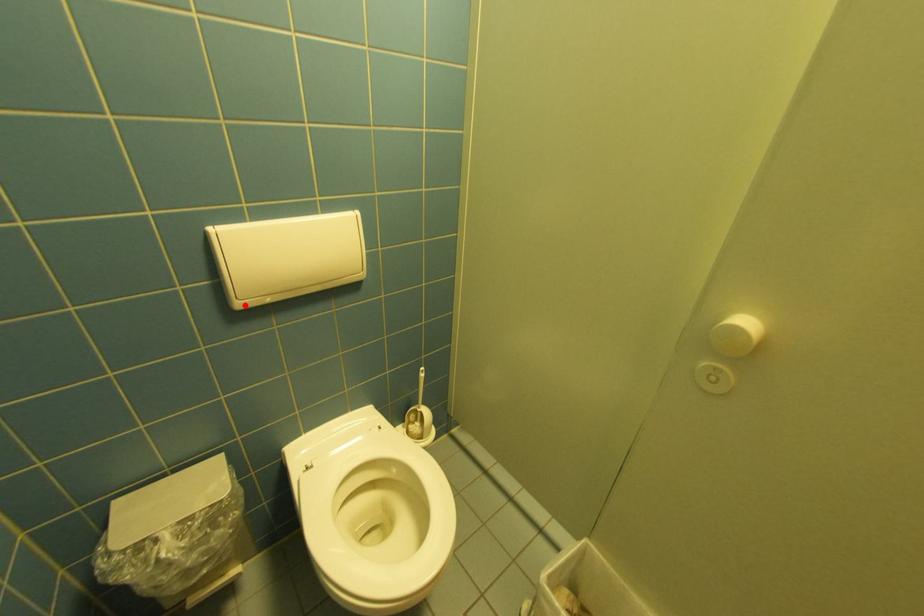
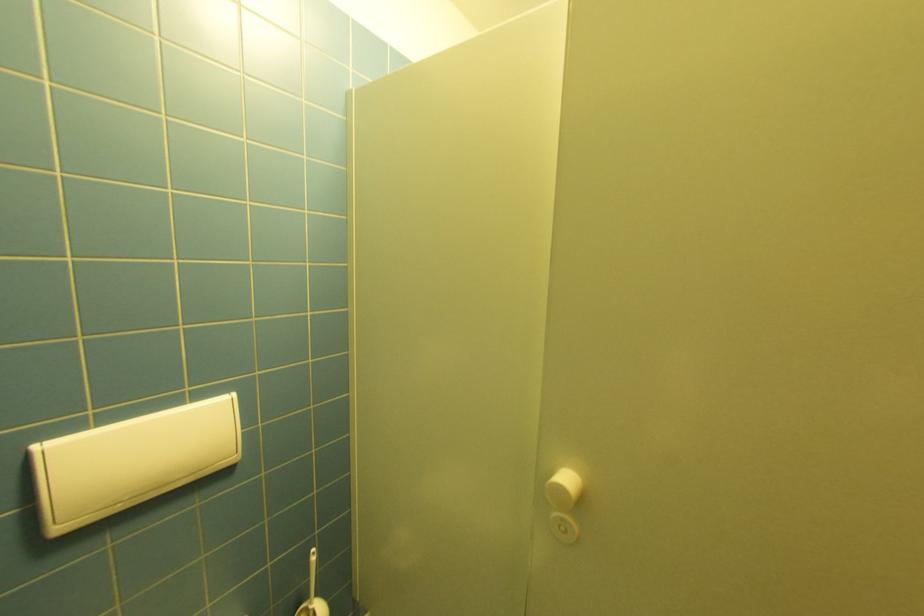
Question: I am providing you with two images of the same scene from different viewpoints. Given a red point in image1, look at the same physical point in image2. Is it:

Choices:
 (A) Closer to the viewpoint
 (B) Farther from the viewpoint

Answer: (B)